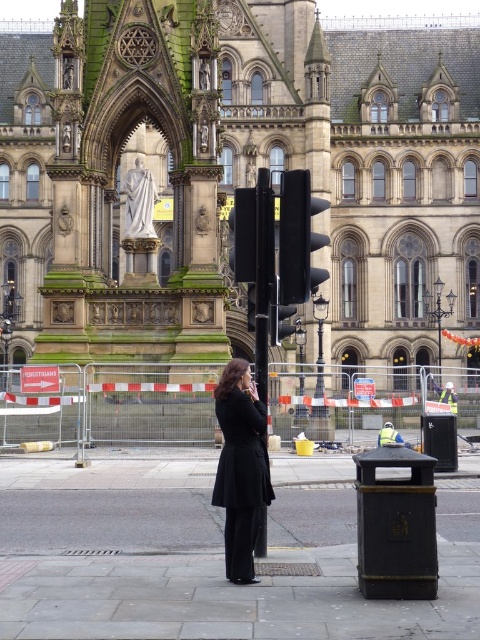
Who is lower down, black matte traffic light at center or black glass traffic light at center?

black glass traffic light at center is below.

The image size is (480, 640). In order to click on black matte traffic light at center in this screenshot , I will do `click(299, 237)`.

Which is behind, point (283, 177) or point (276, 328)?

The point (283, 177) is more distant.

The image size is (480, 640). Find the location of `black matte traffic light at center`. black matte traffic light at center is located at coordinates (299, 237).

Can you confirm if black wool coat at center is positioned above black matte traffic light at center?

No.

In the scene shown: Can you confirm if black wool coat at center is shorter than black matte traffic light at center?

Yes, black wool coat at center is shorter than black matte traffic light at center.

What do you see at coordinates (240, 468) in the screenshot? I see `black wool coat at center` at bounding box center [240, 468].

Where is `black wool coat at center`? Image resolution: width=480 pixels, height=640 pixels. black wool coat at center is located at coordinates (240, 468).

Can you confirm if black glossy pole at center is wider than black glass traffic light at center?

No.

This screenshot has width=480, height=640. What do you see at coordinates (263, 278) in the screenshot?
I see `black glossy pole at center` at bounding box center [263, 278].

Locate an element on the screen. This screenshot has width=480, height=640. black glossy pole at center is located at coordinates (263, 278).